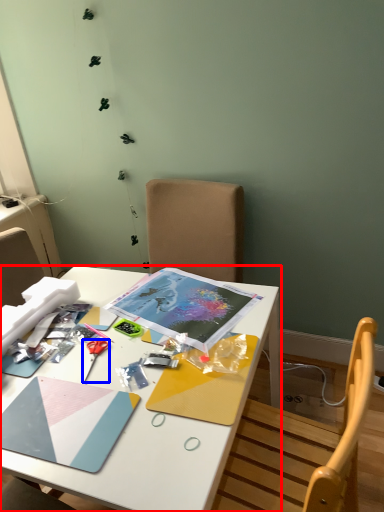
Question: Which of the following is the farthest to the observer, desk (highlighted by a red box) or scissors (highlighted by a blue box)?

Choices:
 (A) desk
 (B) scissors

Answer: (B)